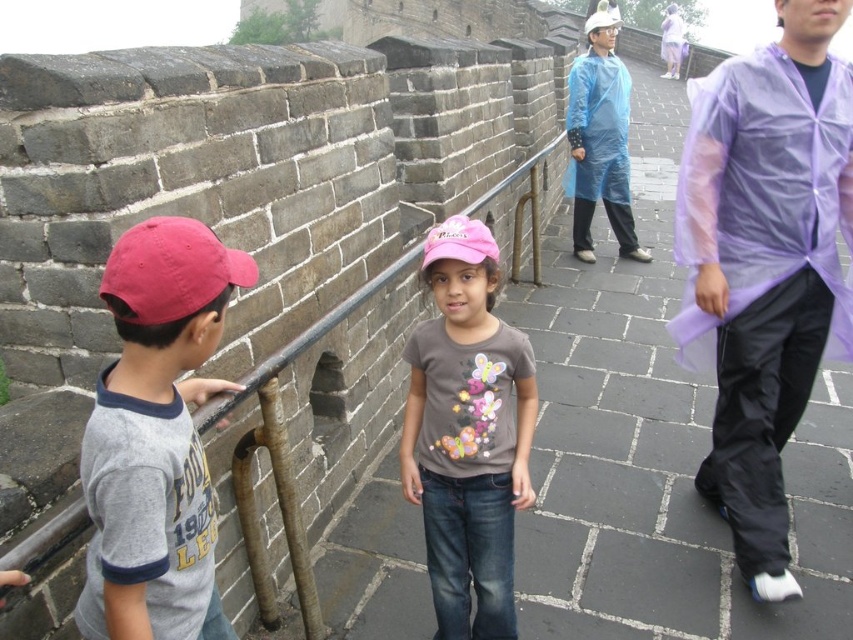
Question: Is pink fabric cap at center below brushed metal rail at center?

Choices:
 (A) no
 (B) yes

Answer: (A)

Question: Does matte gray t-shirt at left appear on the left side of pink fabric cap at center?

Choices:
 (A) yes
 (B) no

Answer: (A)

Question: Which is farther from the transparent purple raincoat at right?

Choices:
 (A) matte gray t-shirt at left
 (B) brushed metal rail at center

Answer: (A)

Question: In this image, where is brushed metal rail at center located relative to blue transparent raincoat at upper center?

Choices:
 (A) below
 (B) above

Answer: (A)

Question: Estimate the real-world distances between objects in this image. Which object is farther from the pink fabric cap at center?

Choices:
 (A) blue transparent raincoat at upper center
 (B) transparent purple raincoat at right

Answer: (A)

Question: Which object appears closest to the camera in this image?

Choices:
 (A) transparent purple raincoat at right
 (B) pink fabric cap at center
 (C) matte gray t-shirt at left
 (D) brushed metal rail at center

Answer: (C)